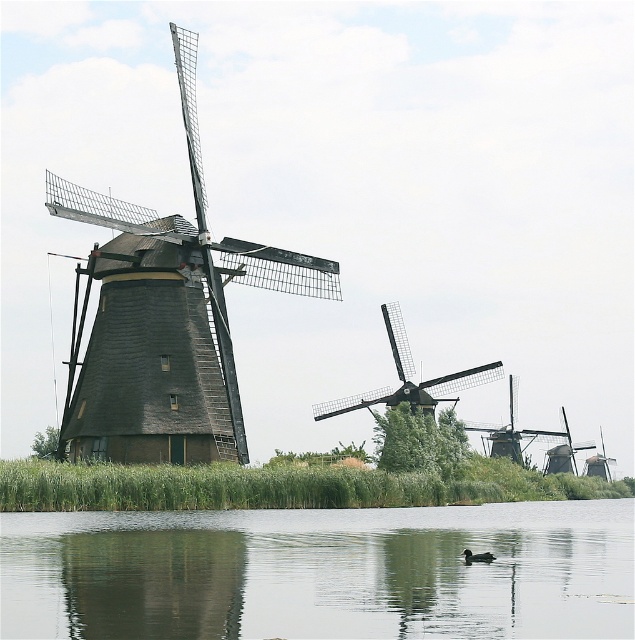
Question: Which of the following is the farthest from the observer?

Choices:
 (A) (485, 371)
 (B) (86, 588)

Answer: (A)

Question: Is transparent water at center positioned at the back of dark gray wooden windmill at left?

Choices:
 (A) no
 (B) yes

Answer: (A)

Question: Is transparent water at center above brown feathered duck at lower center?

Choices:
 (A) yes
 (B) no

Answer: (B)

Question: Which of the following is the farthest from the observer?

Choices:
 (A) dark brown wooden windmill at center
 (B) transparent water at center
 (C) brown feathered duck at lower center
 (D) dark gray wooden windmill at left

Answer: (A)

Question: Is dark brown wooden windmill at center below brown feathered duck at lower center?

Choices:
 (A) no
 (B) yes

Answer: (A)

Question: Which of the following is the closest to the observer?

Choices:
 (A) brown feathered duck at lower center
 (B) transparent water at center

Answer: (B)